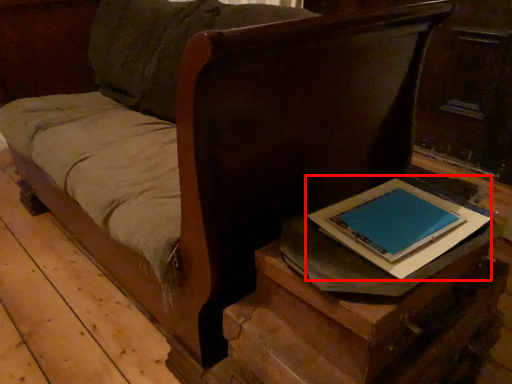
Question: Considering the relative positions of paperback book (annotated by the red box) and table in the image provided, where is paperback book (annotated by the red box) located with respect to the staircase?

Choices:
 (A) left
 (B) right

Answer: (B)